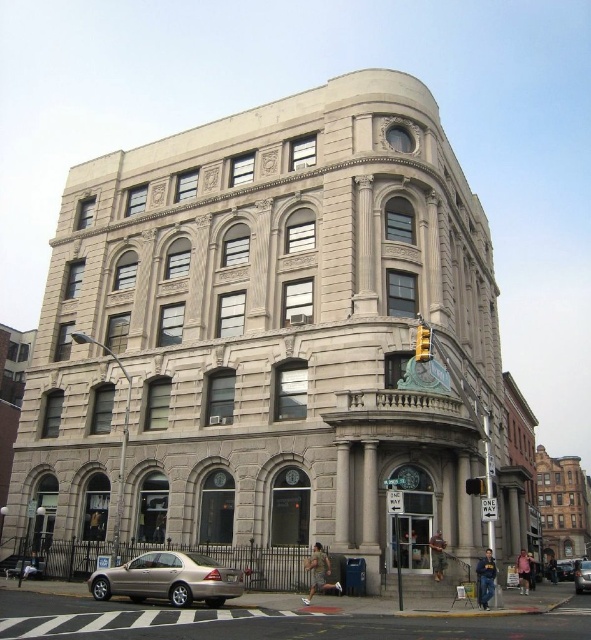
You are a pedestrian standing on the sidewalk in front of the building. You see a gold metallic sedan at lower right and a gold metallic car at center. Which vehicle is closer to you?

The gold metallic sedan at lower right is closer to you because it is in front of the gold metallic car at center.

You are a pedestrian standing on the sidewalk in front of the multi story building. You see the yellow plastic traffic light at upper center and the gold metallic sedan at lower right. Which object appears larger in the image?

The gold metallic sedan at lower right appears larger than the yellow plastic traffic light at upper center in the image.